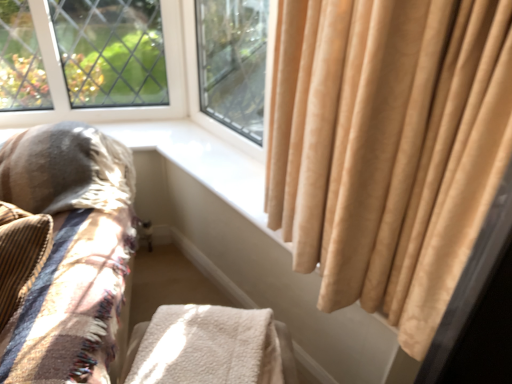
Question: Does plush beige cushion at left turn towards white fluffy blanket at lower center?

Choices:
 (A) yes
 (B) no

Answer: (B)

Question: Considering the relative sizes of plush beige cushion at left and white fluffy blanket at lower center in the image provided, is plush beige cushion at left wider than white fluffy blanket at lower center?

Choices:
 (A) yes
 (B) no

Answer: (A)

Question: Is the depth of plush beige cushion at left greater than that of white fluffy blanket at lower center?

Choices:
 (A) yes
 (B) no

Answer: (B)

Question: Is the position of plush beige cushion at left less distant than that of white fluffy blanket at lower center?

Choices:
 (A) yes
 (B) no

Answer: (A)

Question: Can you confirm if plush beige cushion at left is taller than white fluffy blanket at lower center?

Choices:
 (A) yes
 (B) no

Answer: (A)

Question: Is plush beige cushion at left outside white fluffy blanket at lower center?

Choices:
 (A) yes
 (B) no

Answer: (A)

Question: Is white fluffy blanket at lower center not inside plush beige cushion at left?

Choices:
 (A) yes
 (B) no

Answer: (A)

Question: Does white fluffy blanket at lower center have a lesser width compared to plush beige cushion at left?

Choices:
 (A) yes
 (B) no

Answer: (A)

Question: Is there a large distance between white fluffy blanket at lower center and plush beige cushion at left?

Choices:
 (A) no
 (B) yes

Answer: (A)

Question: Does white fluffy blanket at lower center appear on the left side of plush beige cushion at left?

Choices:
 (A) no
 (B) yes

Answer: (A)

Question: Is plush beige cushion at left at the back of white fluffy blanket at lower center?

Choices:
 (A) yes
 (B) no

Answer: (B)

Question: Does white fluffy blanket at lower center touch plush beige cushion at left?

Choices:
 (A) yes
 (B) no

Answer: (B)

Question: Do you think white fluffy blanket at lower center is within plush beige cushion at left, or outside of it?

Choices:
 (A) inside
 (B) outside

Answer: (B)